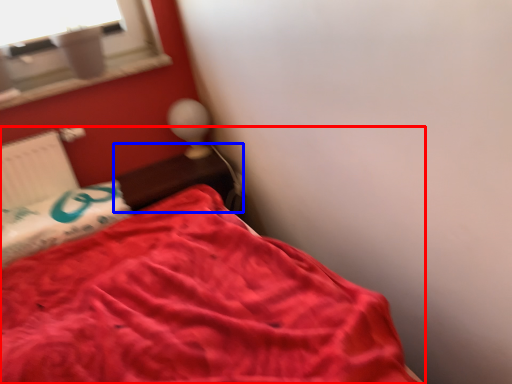
Question: Which object is closer to the camera taking this photo, bed (highlighted by a red box) or table (highlighted by a blue box)?

Choices:
 (A) bed
 (B) table

Answer: (A)